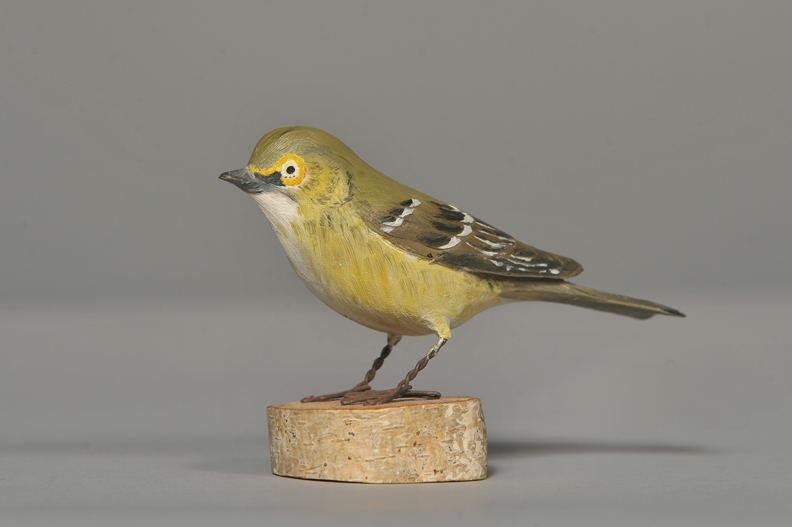
Locate an element on the screen. floor is located at coordinates (170, 347).